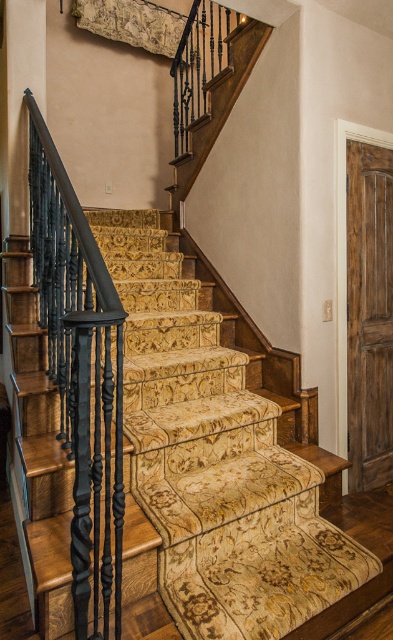
Is black wrought iron railing at left wider than rustic wood door at right?

Correct, the width of black wrought iron railing at left exceeds that of rustic wood door at right.

Does black wrought iron railing at left appear on the right side of rustic wood door at right?

No, black wrought iron railing at left is not to the right of rustic wood door at right.

Who is more forward, (95, 502) or (374, 166)?

Positioned in front is point (95, 502).

Locate an element on the screen. The width and height of the screenshot is (393, 640). black wrought iron railing at left is located at coordinates (80, 372).

Does carpeted stairs at center appear on the right side of black wrought iron railing at left?

Correct, you'll find carpeted stairs at center to the right of black wrought iron railing at left.

Locate an element on the screen. Image resolution: width=393 pixels, height=640 pixels. carpeted stairs at center is located at coordinates (224, 472).

Between point (332, 616) and point (352, 369), which one is positioned in front?

Point (332, 616)

How much distance is there between carpeted stairs at center and rustic wood door at right?

They are 32.89 inches apart.

This screenshot has height=640, width=393. Identify the location of carpeted stairs at center. (224, 472).

The width and height of the screenshot is (393, 640). What are the coordinates of `carpeted stairs at center` in the screenshot? It's located at (224, 472).